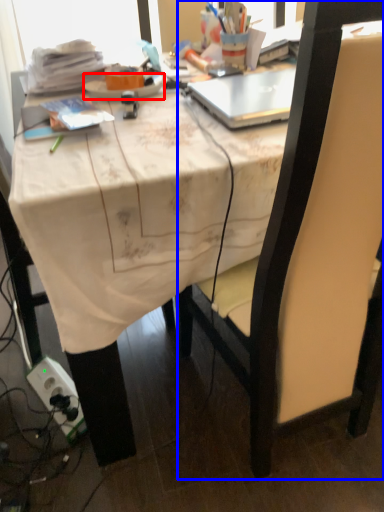
Question: Among these objects, which one is nearest to the camera, plate (highlighted by a red box) or chair (highlighted by a blue box)?

Choices:
 (A) plate
 (B) chair

Answer: (B)